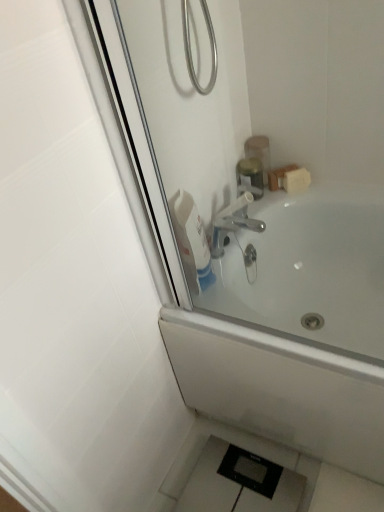
Question: Is white glossy bottle at upper center not close to metallic gold container at upper center, marked as the second toiletry in a bottom-to-top arrangement?

Choices:
 (A) no
 (B) yes

Answer: (A)

Question: Is white glossy bottle at upper center with metallic gold container at upper center, which is the first toiletry in top-to-bottom order?

Choices:
 (A) no
 (B) yes

Answer: (A)

Question: From the image's perspective, is white glossy bottle at upper center located above metallic gold container at upper center, marked as the second toiletry in a bottom-to-top arrangement?

Choices:
 (A) no
 (B) yes

Answer: (A)

Question: Does white glossy bottle at upper center have a larger size compared to metallic gold container at upper center, which is the first toiletry in top-to-bottom order?

Choices:
 (A) no
 (B) yes

Answer: (B)

Question: Is metallic gold container at upper center, which is the first toiletry in top-to-bottom order, located within white glossy bottle at upper center?

Choices:
 (A) no
 (B) yes

Answer: (A)

Question: From a real-world perspective, is white glossy bottle at upper center below metallic gold container at upper center, marked as the second toiletry in a bottom-to-top arrangement?

Choices:
 (A) no
 (B) yes

Answer: (A)

Question: Can you confirm if white glossy bathtub at upper center is bigger than metallic gold container at upper center, marked as the second toiletry in a bottom-to-top arrangement?

Choices:
 (A) yes
 (B) no

Answer: (A)

Question: Is white glossy bathtub at upper center positioned behind metallic gold container at upper center, which is the first toiletry in top-to-bottom order?

Choices:
 (A) yes
 (B) no

Answer: (B)

Question: Considering the relative positions of white glossy bathtub at upper center and metallic gold container at upper center, which is the first toiletry in top-to-bottom order, in the image provided, is white glossy bathtub at upper center to the right of metallic gold container at upper center, which is the first toiletry in top-to-bottom order, from the viewer's perspective?

Choices:
 (A) yes
 (B) no

Answer: (A)

Question: Is the position of white glossy bathtub at upper center less distant than that of metallic gold container at upper center, marked as the second toiletry in a bottom-to-top arrangement?

Choices:
 (A) yes
 (B) no

Answer: (A)

Question: Can you confirm if white glossy bathtub at upper center is shorter than metallic gold container at upper center, marked as the second toiletry in a bottom-to-top arrangement?

Choices:
 (A) no
 (B) yes

Answer: (A)

Question: Considering the relative sizes of white glossy bathtub at upper center and metallic gold container at upper center, which is the first toiletry in top-to-bottom order, in the image provided, is white glossy bathtub at upper center smaller than metallic gold container at upper center, which is the first toiletry in top-to-bottom order,?

Choices:
 (A) no
 (B) yes

Answer: (A)

Question: Is white glossy bottle at upper center at the right side of metallic silver soap dispenser at upper right, which ranks as the second toiletry in top-to-bottom order?

Choices:
 (A) no
 (B) yes

Answer: (A)